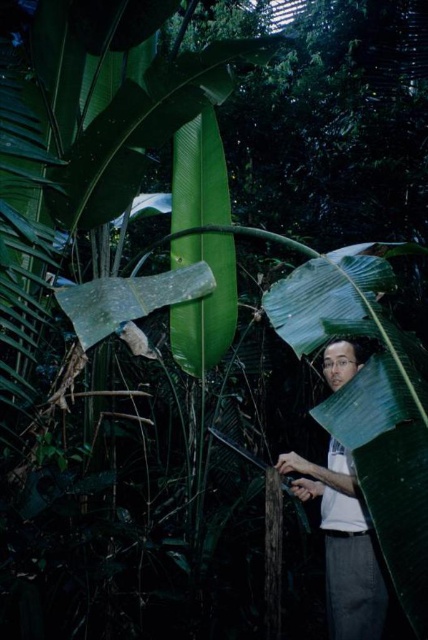
Question: Which object is closer to the camera taking this photo?

Choices:
 (A) green rough textured leaf at center
 (B) white matte shirt at right

Answer: (A)

Question: Which point is farther from the camera taking this photo?

Choices:
 (A) tap(333, 548)
 (B) tap(119, 284)

Answer: (A)

Question: Can you confirm if white matte shirt at right is positioned to the right of green rough textured leaf at center?

Choices:
 (A) yes
 (B) no

Answer: (A)

Question: Which object is farther from the camera taking this photo?

Choices:
 (A) green rough textured leaf at center
 (B) white matte shirt at right

Answer: (B)

Question: Does white matte shirt at right appear over green rough textured leaf at center?

Choices:
 (A) yes
 (B) no

Answer: (B)

Question: Is white matte shirt at right in front of green rough textured leaf at center?

Choices:
 (A) yes
 (B) no

Answer: (B)